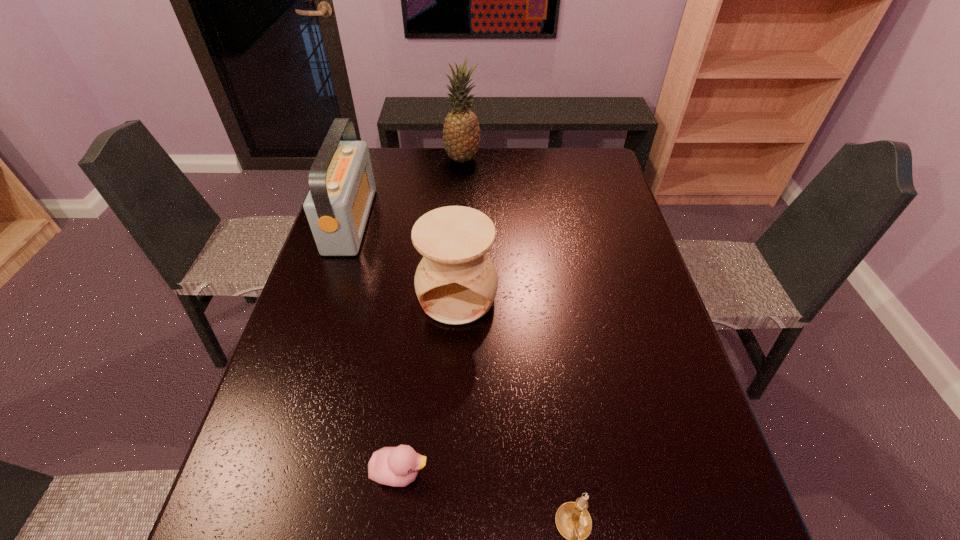
The width and height of the screenshot is (960, 540). In order to click on vacant space situated at the open side of the pottery in this screenshot , I will do click(454, 361).

Identify the location of vacant space located 0.400m on the front-facing side of the second nearest object. click(636, 472).

I want to click on object that is at the far edge, so click(461, 133).

Image resolution: width=960 pixels, height=540 pixels. I want to click on object situated at the left edge, so click(342, 187).

In the image, there is a desktop. Where is `vacant region at the far edge`? This screenshot has width=960, height=540. vacant region at the far edge is located at coordinates (506, 158).

Locate an element on the screen. Image resolution: width=960 pixels, height=540 pixels. free region at the near edge is located at coordinates pos(596,533).

At what (x,y) coordinates should I click in order to perform the action: click on vacant area at the left edge of the desktop. Please return your answer as a coordinate pair (x, y). Looking at the image, I should click on (327, 280).

The width and height of the screenshot is (960, 540). I want to click on free space at the right edge of the desktop, so tap(634, 415).

I want to click on vacant space at the far left corner of the desktop, so click(396, 163).

Find the location of a particular element. The height and width of the screenshot is (540, 960). empty location between the tallest object and the second farthest object is located at coordinates (406, 190).